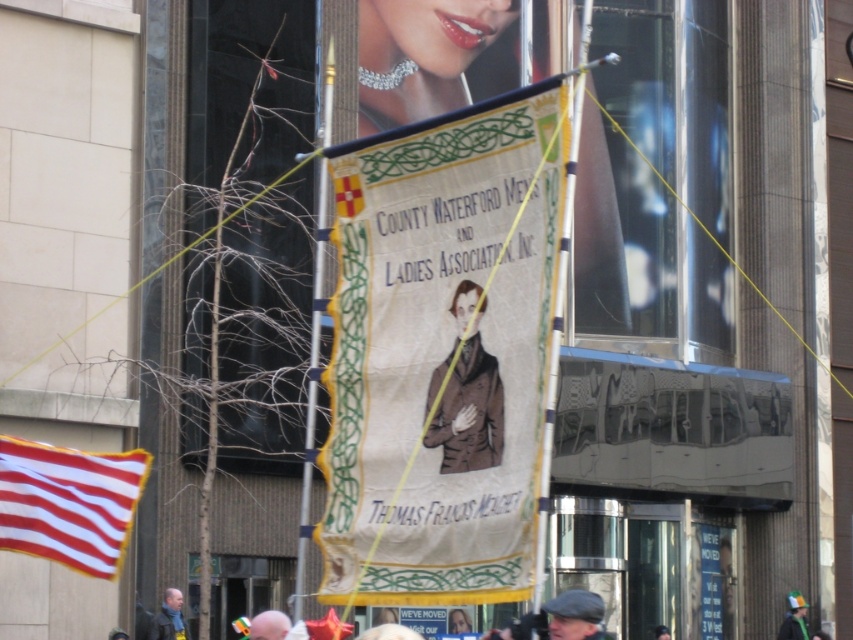
You are a photographer trying to capture the banner clearly. You notice two elements in the foreground that might obstruct your view. Which object is closer to the camera between the brown textured coat at center and the light brown hair at lower center?

The light brown hair at lower center is closer to the camera because the brown textured coat at center is positioned on the right side of it, indicating it is behind.

Based on the scene description, can you determine which object is closer to the observer between the green fabric hat at center and the light brown hair at lower center?

The light brown hair at lower center is behind the green fabric hat at center, so the green fabric hat at center is closer to the observer.

From the picture: You are a photographer trying to capture the banner clearly. You notice the red and white striped fabric at left and the green fabric hat at center. Which object should you focus on to ensure the banner is in focus?

The red and white striped fabric at left is in front of the green fabric hat at center. To ensure the banner is in focus, you should focus on the red and white striped fabric at left since it is closer to the camera.